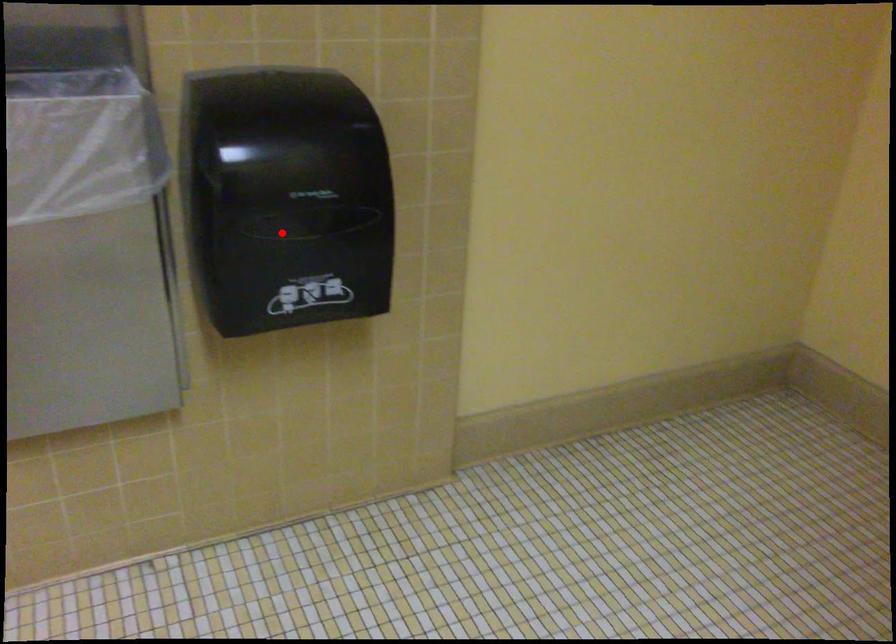
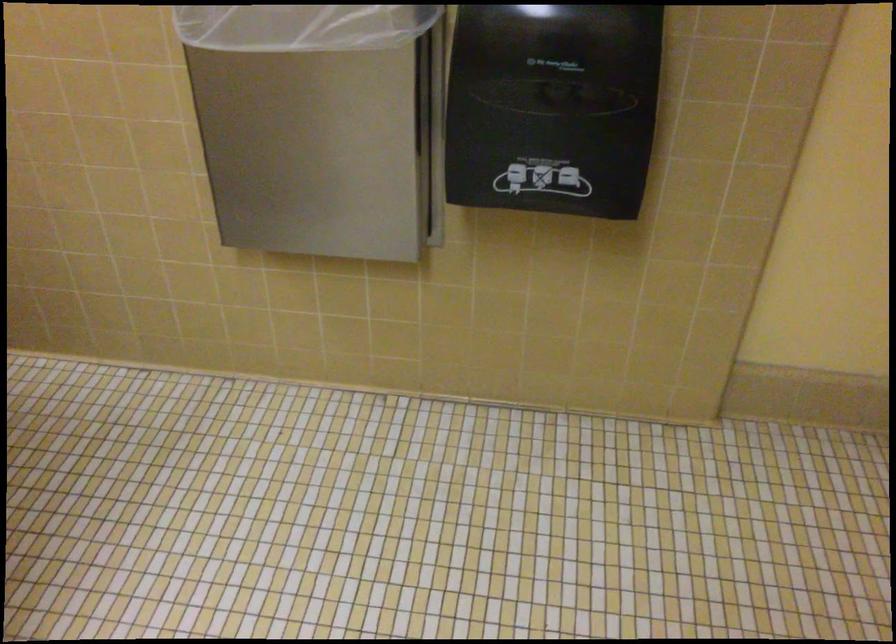
Question: A red point is marked in image1. In image2, is the corresponding 3D point closer to the camera or farther? Reply with the corresponding letter.

Choices:
 (A) The corresponding 3D point is closer.
 (B) The corresponding 3D point is farther.

Answer: (A)